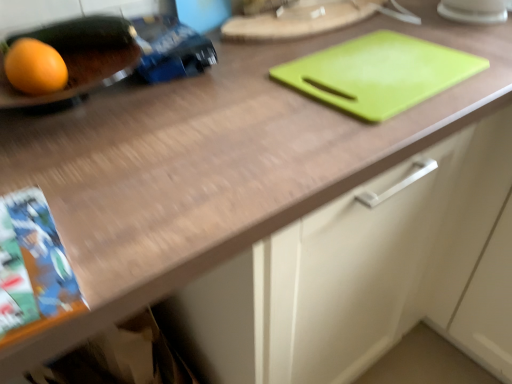
Image resolution: width=512 pixels, height=384 pixels. I want to click on free space on the front side of matte black tray at left, arranged as the first tray when viewed from the left, so click(x=78, y=129).